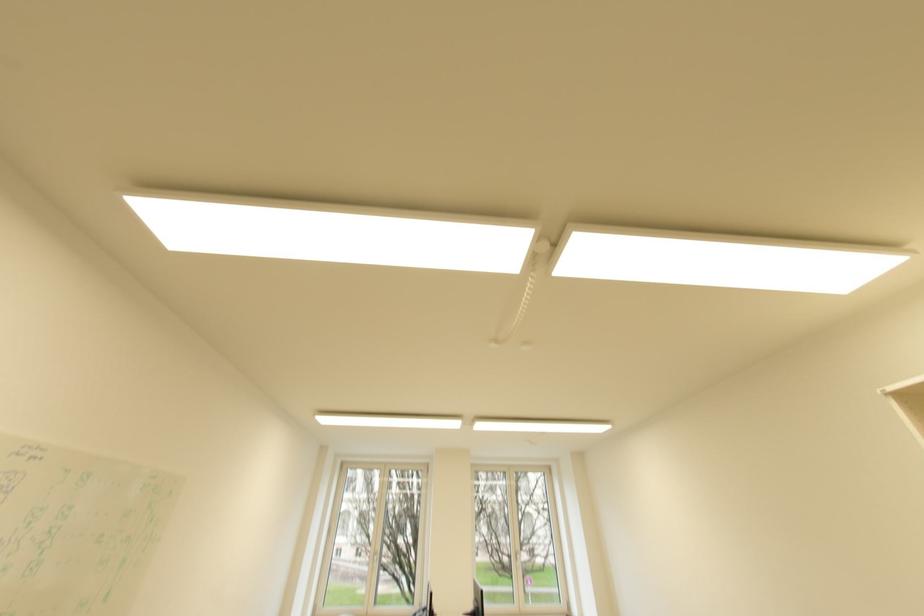
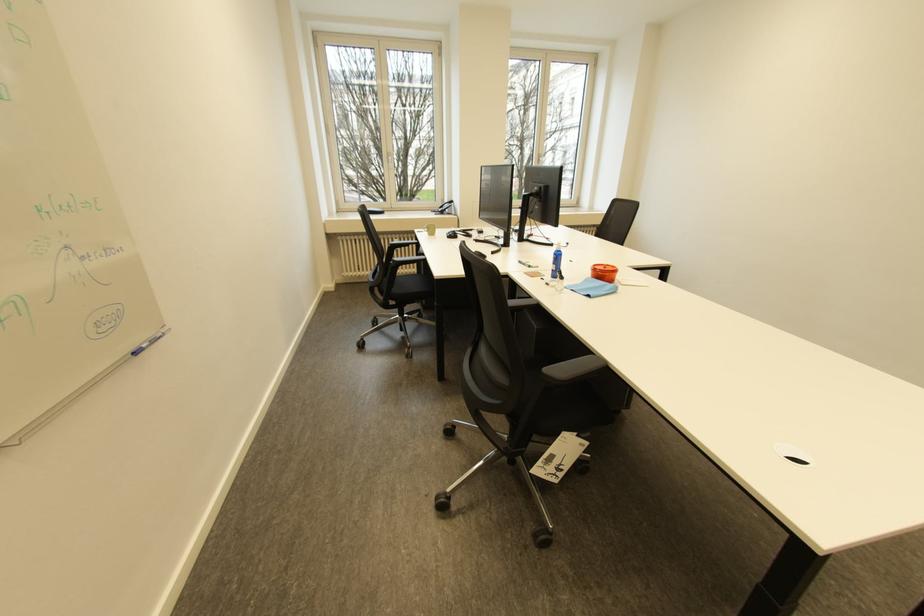
In the second image, find the point that corresponds to (415,541) in the first image.

(386, 171)